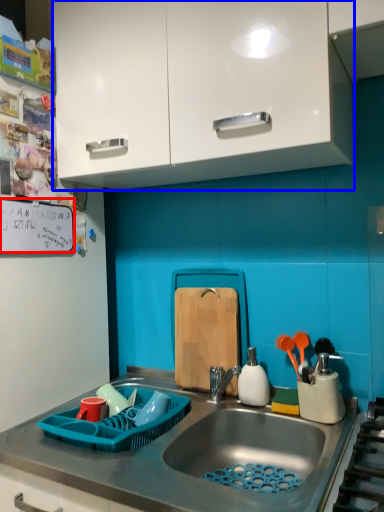
Question: Which object is further to the camera taking this photo, bulletin board (highlighted by a red box) or cabinetry (highlighted by a blue box)?

Choices:
 (A) bulletin board
 (B) cabinetry

Answer: (A)